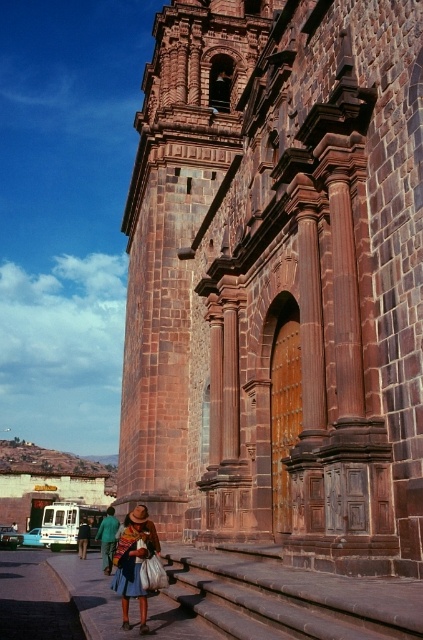
Question: Among these points, which one is nearest to the camera?

Choices:
 (A) (128, 600)
 (B) (390, 593)
 (C) (271, 438)

Answer: (B)

Question: Can you confirm if brown stone church at center is thinner than brown stone stairs at lower center?

Choices:
 (A) no
 (B) yes

Answer: (A)

Question: Based on their relative distances, which object is nearer to the blue woven skirt at lower center?

Choices:
 (A) brown stone church at center
 (B) brown stone stairs at lower center

Answer: (B)

Question: Which object appears closest to the camera in this image?

Choices:
 (A) brown stone stairs at lower center
 (B) brown stone church at center

Answer: (A)

Question: Does brown stone stairs at lower center appear over blue woven skirt at lower center?

Choices:
 (A) no
 (B) yes

Answer: (B)

Question: Can you confirm if brown stone church at center is positioned to the right of brown stone stairs at lower center?

Choices:
 (A) no
 (B) yes

Answer: (A)